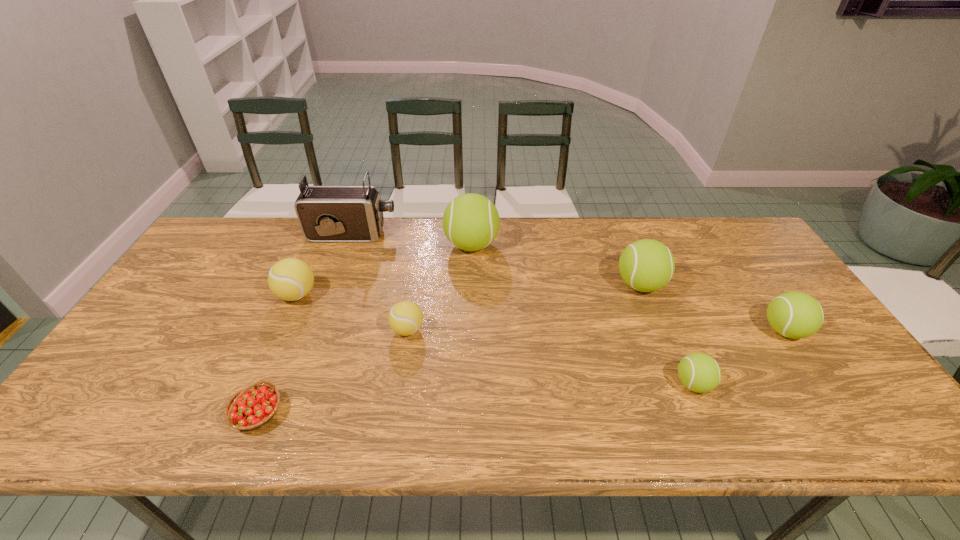
The image size is (960, 540). I want to click on free location that satisfies the following two spatial constraints: 1. at the lens of the camcorder; 2. on the front side of the brown strawberry, so click(x=288, y=414).

Locate an element on the screen. vacant space that satisfies the following two spatial constraints: 1. on the back side of the fourth object from left to right; 2. at the lens of the camcorder is located at coordinates (422, 234).

Locate an element on the screen. Image resolution: width=960 pixels, height=540 pixels. free spot that satisfies the following two spatial constraints: 1. at the lens of the tallest tennis ball; 2. on the left side of the tallest object is located at coordinates (348, 245).